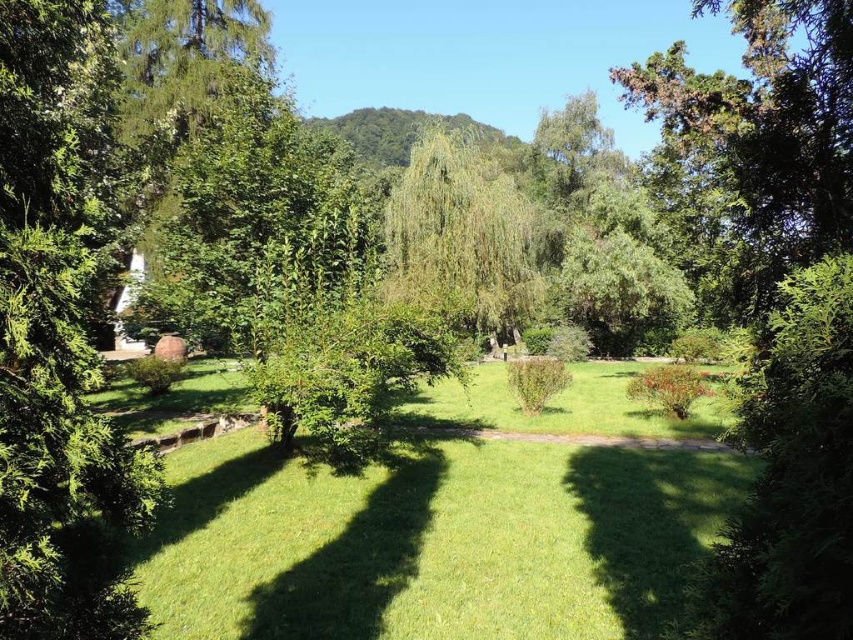
Does green grass at center have a lesser width compared to green leafy tree at center?

No, green grass at center is not thinner than green leafy tree at center.

Between green grass at center and green leafy tree at center, which one is positioned higher?

green leafy tree at center is higher up.

In order to click on green grass at center in this screenshot , I will do `click(432, 540)`.